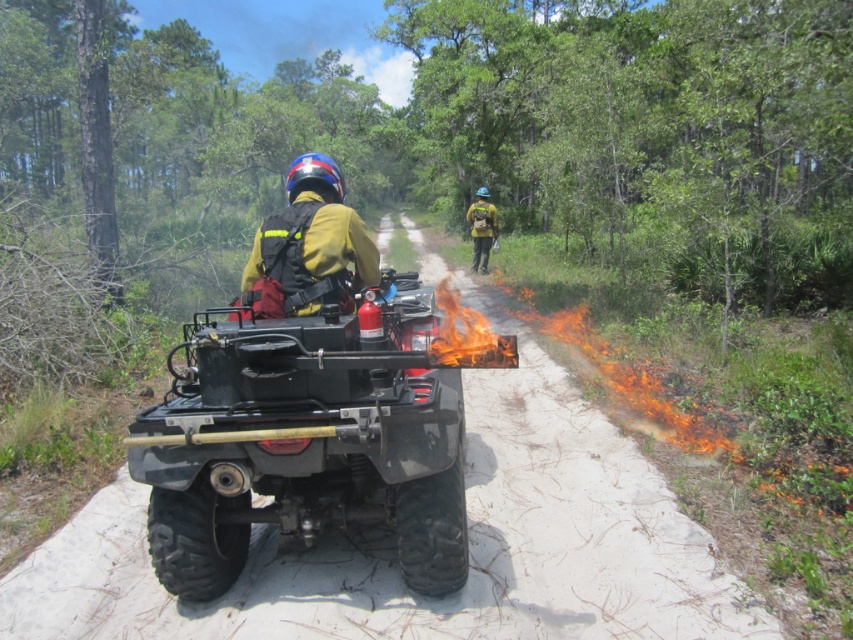
Question: Which point is farther from the camera taking this photo?

Choices:
 (A) (555, 438)
 (B) (285, 244)

Answer: (A)

Question: Is dirt track at center positioned before yellow fabric backpack at center?

Choices:
 (A) yes
 (B) no

Answer: (A)

Question: Which point appears closest to the camera in this image?

Choices:
 (A) (x=483, y=257)
 (B) (x=161, y=577)
 (C) (x=181, y=618)
 (D) (x=296, y=248)

Answer: (B)

Question: Can you confirm if matte black quad at center is positioned above yellow fire-resistant suit at center?

Choices:
 (A) yes
 (B) no

Answer: (B)

Question: Considering the real-world distances, which object is closest to the yellow fire-resistant suit at center?

Choices:
 (A) yellow fabric backpack at center
 (B) matte black quad at center

Answer: (B)

Question: Is dirt track at center smaller than yellow fabric backpack at center?

Choices:
 (A) yes
 (B) no

Answer: (B)